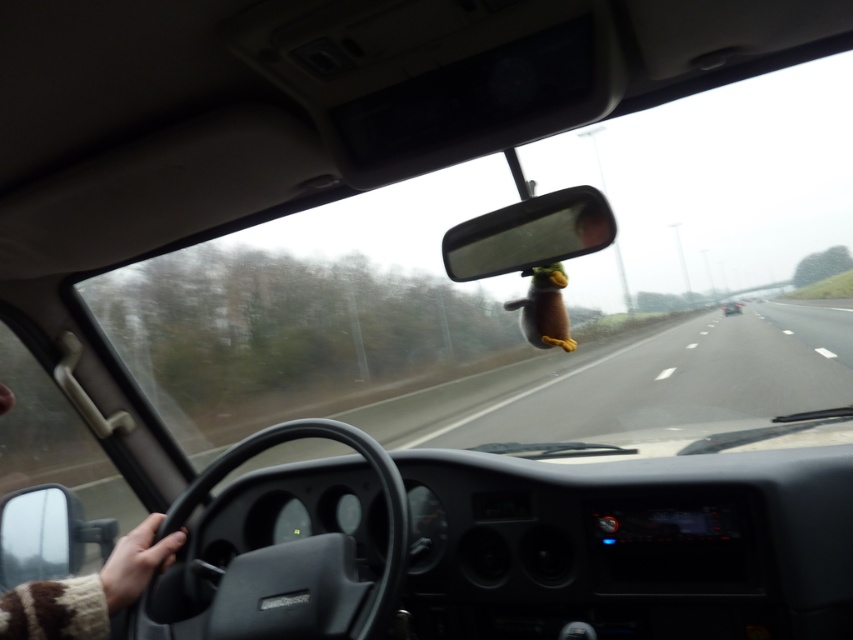
Is clear plastic view mirror at center shorter than matte black car at center?

Indeed, clear plastic view mirror at center has a lesser height compared to matte black car at center.

Is clear plastic view mirror at center positioned in front of matte black car at center?

Yes.

This screenshot has height=640, width=853. What do you see at coordinates (529, 234) in the screenshot?
I see `clear plastic view mirror at center` at bounding box center [529, 234].

Image resolution: width=853 pixels, height=640 pixels. In order to click on clear plastic view mirror at center in this screenshot , I will do `click(529, 234)`.

How far apart are transparent glass windshield at center and clear plastic view mirror at center?

transparent glass windshield at center is 12.93 meters away from clear plastic view mirror at center.

Between point (183, 380) and point (527, 237), which one is positioned in front?

Point (527, 237)

Find the location of a particular element. This screenshot has width=853, height=640. transparent glass windshield at center is located at coordinates (520, 289).

Can you confirm if transparent glass windshield at center is bigger than matte black car at center?

Yes, transparent glass windshield at center is bigger than matte black car at center.

Which is in front, point (227, 278) or point (722, 308)?

Point (227, 278) is more forward.

This screenshot has width=853, height=640. I want to click on transparent glass windshield at center, so click(x=520, y=289).